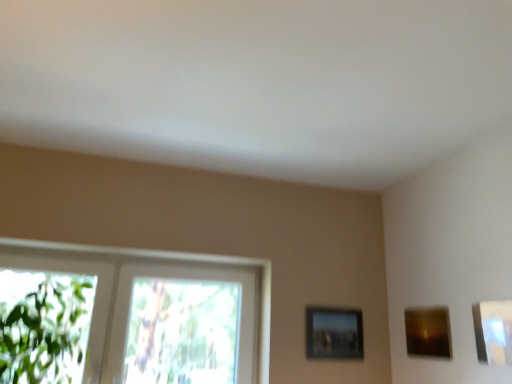
Question: Does point (120, 268) appear closer or farther from the camera than point (501, 307)?

Choices:
 (A) closer
 (B) farther

Answer: (B)

Question: Is clear glass window at left to the left or to the right of metallic silver picture frame at upper right, marked as the first picture frame in a front-to-back arrangement, in the image?

Choices:
 (A) left
 (B) right

Answer: (A)

Question: Which of these objects is positioned farthest from the clear glass window at left?

Choices:
 (A) matte brown picture frame at upper right, which appears as the 2th picture frame when viewed from the right
 (B) metallic silver picture frame at center-right, the third picture frame in the front-to-back sequence
 (C) metallic silver picture frame at upper right, marked as the first picture frame in a front-to-back arrangement

Answer: (C)

Question: Estimate the real-world distances between objects in this image. Which object is farther from the matte brown picture frame at upper right, positioned as the second picture frame in front-to-back order?

Choices:
 (A) metallic silver picture frame at upper right, which is counted as the 1th picture frame, starting from the right
 (B) metallic silver picture frame at center-right, positioned as the 1th picture frame in left-to-right order
 (C) clear glass window at left

Answer: (C)